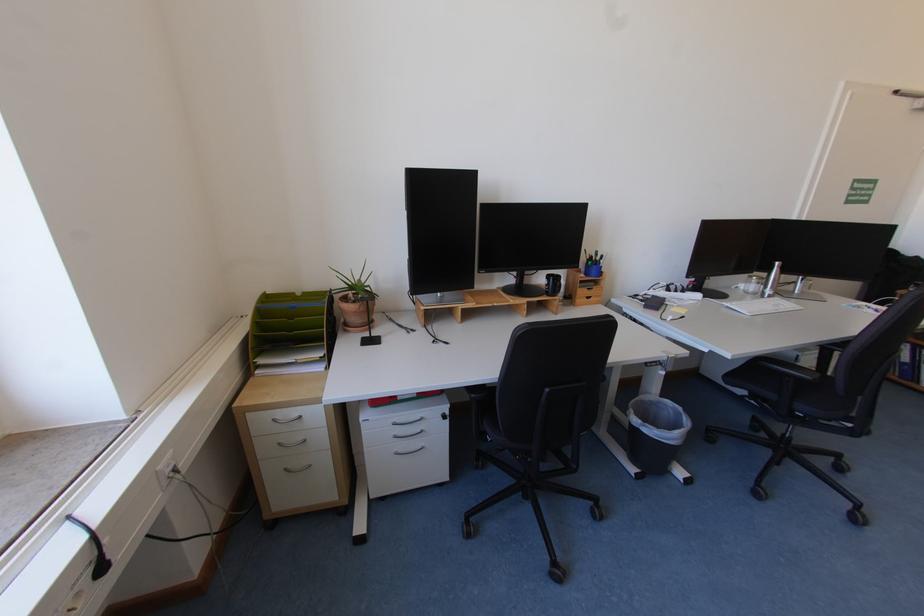
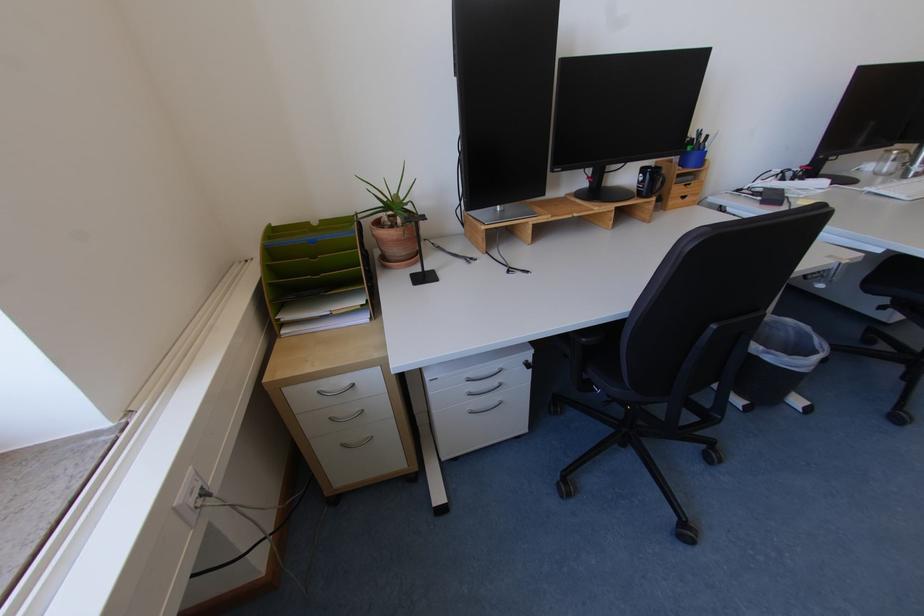
The point at (164,472) is marked in the first image. Where is the corresponding point in the second image?

(181, 509)